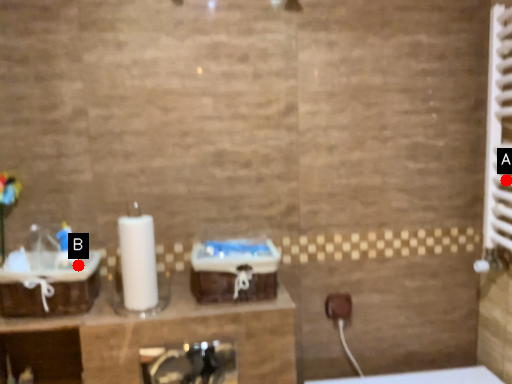
Question: Two points are circled on the image, labeled by A and B beside each circle. Among these points, which one is farthest from the camera?

Choices:
 (A) A is further
 (B) B is further

Answer: (A)